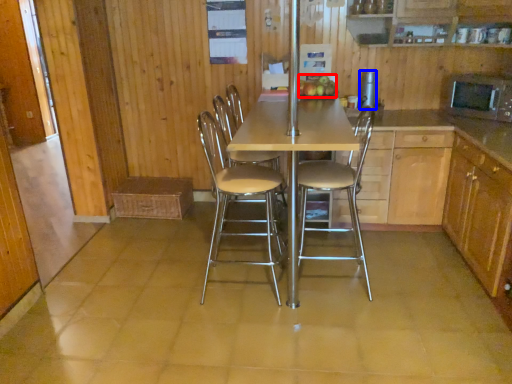
Question: Which object is further to the camera taking this photo, fruit (highlighted by a red box) or appliance (highlighted by a blue box)?

Choices:
 (A) fruit
 (B) appliance

Answer: (B)